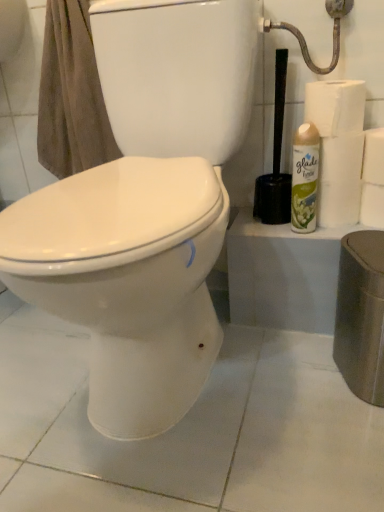
Locate an element on the screen. black plastic toilet brush at right is located at coordinates (275, 160).

The width and height of the screenshot is (384, 512). What do you see at coordinates (305, 178) in the screenshot?
I see `green matte air freshener at right` at bounding box center [305, 178].

Identify the location of green matte air freshener at right. (305, 178).

At what (x,y) coordinates should I click in order to perform the action: click on black plastic toilet brush at right. Please return your answer as a coordinate pair (x, y). The image size is (384, 512). Looking at the image, I should click on (275, 160).

From the image's perspective, is white paper at right, placed as the 4th toilet paper when sorted from top to bottom, below metallic silver showerhead at upper right?

Yes, from the image's perspective, white paper at right, placed as the 4th toilet paper when sorted from top to bottom, is below metallic silver showerhead at upper right.

Considering the relative positions of white paper at right, the first toilet paper from the bottom, and metallic silver showerhead at upper right in the image provided, is white paper at right, the first toilet paper from the bottom, to the left of metallic silver showerhead at upper right from the viewer's perspective?

In fact, white paper at right, the first toilet paper from the bottom, is to the right of metallic silver showerhead at upper right.

Is there a large distance between white paper at right, placed as the 4th toilet paper when sorted from top to bottom, and metallic silver showerhead at upper right?

No, white paper at right, placed as the 4th toilet paper when sorted from top to bottom, is not far from metallic silver showerhead at upper right.

Between white paper at right, placed as the 4th toilet paper when sorted from top to bottom, and metallic silver showerhead at upper right, which one has smaller size?

white paper at right, placed as the 4th toilet paper when sorted from top to bottom, is smaller.

Considering the positions of objects white paper at right, placed as the 4th toilet paper when sorted from top to bottom, and black plastic toilet brush at right in the image provided, who is in front, white paper at right, placed as the 4th toilet paper when sorted from top to bottom, or black plastic toilet brush at right?

black plastic toilet brush at right is in front.

Which is correct: white paper at right, placed as the 4th toilet paper when sorted from top to bottom, is inside black plastic toilet brush at right, or outside of it?

The correct answer is: outside.

Is white paper at right, the first toilet paper from the bottom, at the right side of black plastic toilet brush at right?

Yes, white paper at right, the first toilet paper from the bottom, is to the right of black plastic toilet brush at right.

How different are the orientations of white paper at right, the first toilet paper from the bottom, and black plastic toilet brush at right in degrees?

The angle between the facing direction of white paper at right, the first toilet paper from the bottom, and the facing direction of black plastic toilet brush at right is 0.0173 degrees.

Is point (51, 16) positioned in front of point (359, 124)?

No, (51, 16) is further to viewer.

In the scene shown: Is brown cotton towel at upper left next to white paper towel at upper right, which ranks as the 1th toilet paper in top-to-bottom order, and touching it?

They are not placed beside each other.

Image resolution: width=384 pixels, height=512 pixels. I want to click on bath towel positioned vertically above the white paper towel at upper right, which ranks as the 1th toilet paper in top-to-bottom order (from a real-world perspective), so click(x=71, y=95).

Does black plastic toilet brush at right appear on the left side of brown cotton towel at upper left?

In fact, black plastic toilet brush at right is to the right of brown cotton towel at upper left.

Can you tell me how much black plastic toilet brush at right and brown cotton towel at upper left differ in facing direction?

The angular difference between black plastic toilet brush at right and brown cotton towel at upper left is 0.0821 degrees.

Are black plastic toilet brush at right and brown cotton towel at upper left located far from each other?

That's not correct — black plastic toilet brush at right is a little close to brown cotton towel at upper left.

Is green matte air freshener at right in contact with white paper towel at right, the 3th toilet paper in the top-to-bottom sequence?

Yes, green matte air freshener at right is next to white paper towel at right, the 3th toilet paper in the top-to-bottom sequence.

Looking at this image, is green matte air freshener at right looking in the opposite direction of white paper towel at right, marked as the 2th toilet paper in a bottom-to-top arrangement?

green matte air freshener at right is not turned away from white paper towel at right, marked as the 2th toilet paper in a bottom-to-top arrangement.

Between green matte air freshener at right and white paper towel at right, marked as the 2th toilet paper in a bottom-to-top arrangement, which one has smaller width?

Thinner between the two is green matte air freshener at right.

Which is closer to the camera, (316, 152) or (333, 215)?

Point (316, 152).

From the image's perspective, is white paper towel at right, the 3th toilet paper in the top-to-bottom sequence, over metallic silver showerhead at upper right?

No, from the image's perspective, white paper towel at right, the 3th toilet paper in the top-to-bottom sequence, is not over metallic silver showerhead at upper right.

Does white paper towel at right, marked as the 2th toilet paper in a bottom-to-top arrangement, appear on the right side of metallic silver showerhead at upper right?

Correct, you'll find white paper towel at right, marked as the 2th toilet paper in a bottom-to-top arrangement, to the right of metallic silver showerhead at upper right.

Is point (333, 199) positioned behind point (296, 36)?

Yes, point (333, 199) is behind point (296, 36).

Is point (105, 119) closer to camera compared to point (368, 204)?

That is False.

Is brown cotton towel at upper left oriented towards white paper at right, the first toilet paper from the bottom?

No.

Looking at this image, considering the relative sizes of brown cotton towel at upper left and white paper at right, the first toilet paper from the bottom, in the image provided, is brown cotton towel at upper left shorter than white paper at right, the first toilet paper from the bottom,?

No.

Which object is closer to the camera, brown cotton towel at upper left or white paper at right, placed as the 4th toilet paper when sorted from top to bottom?

brown cotton towel at upper left is more forward.

Where is `the 3rd toilet paper below the metallic silver showerhead at upper right (from a real-world perspective)`? This screenshot has height=512, width=384. the 3rd toilet paper below the metallic silver showerhead at upper right (from a real-world perspective) is located at coordinates (372, 205).

Image resolution: width=384 pixels, height=512 pixels. I want to click on brush that appears above the white paper at right, placed as the 4th toilet paper when sorted from top to bottom (from the image's perspective), so click(x=275, y=160).

Estimate the real-world distances between objects in this image. Which object is further from white paper towel at upper right, arranged as the 4th toilet paper when ordered from the bottom, white paper at right, placed as the 4th toilet paper when sorted from top to bottom, or brown cotton towel at upper left?

brown cotton towel at upper left.

Considering their positions, is metallic silver showerhead at upper right positioned closer to white paper at right, the first toilet paper from the bottom, than white paper at right, the second toilet paper from the top?

white paper at right, the second toilet paper from the top, lies closer to white paper at right, the first toilet paper from the bottom, than the other object.

Based on their spatial positions, is white paper towel at upper right, which ranks as the 1th toilet paper in top-to-bottom order, or brown cotton towel at upper left further from black plastic toilet brush at right?

Based on the image, brown cotton towel at upper left appears to be further to black plastic toilet brush at right.

Considering their positions, is green matte air freshener at right positioned further to white paper at right, placed as the 4th toilet paper when sorted from top to bottom, than black plastic toilet brush at right?

Among the two, black plastic toilet brush at right is located further to white paper at right, placed as the 4th toilet paper when sorted from top to bottom.

Which object lies further to the anchor point green matte air freshener at right, white paper at right, marked as the third toilet paper in a bottom-to-top arrangement, or white paper at right, placed as the 4th toilet paper when sorted from top to bottom?

white paper at right, placed as the 4th toilet paper when sorted from top to bottom, lies further to green matte air freshener at right than the other object.

From the image, which object appears to be nearer to brown cotton towel at upper left, white paper at right, placed as the 4th toilet paper when sorted from top to bottom, or white paper towel at right, the 3th toilet paper in the top-to-bottom sequence?

white paper towel at right, the 3th toilet paper in the top-to-bottom sequence, is closer to brown cotton towel at upper left.

From the picture: Looking at the image, which one is located closer to brown cotton towel at upper left, metallic silver showerhead at upper right or white paper towel at upper right, arranged as the 4th toilet paper when ordered from the bottom?

Based on the image, metallic silver showerhead at upper right appears to be nearer to brown cotton towel at upper left.

Which object lies nearer to the anchor point green matte air freshener at right, white paper towel at right, the 3th toilet paper in the top-to-bottom sequence, or white paper at right, placed as the 4th toilet paper when sorted from top to bottom?

white paper towel at right, the 3th toilet paper in the top-to-bottom sequence.

You are a GUI agent. You are given a task and a screenshot of the screen. Output one action in this format:
    pyautogui.click(x=<x>, y=<y>)
    Task: Click on the cleaning product between metallic silver showerhead at upper right and white paper towel at right, the 3th toilet paper in the top-to-bottom sequence, from top to bottom
    This screenshot has width=384, height=512.
    Given the screenshot: What is the action you would take?
    pyautogui.click(x=305, y=178)

Locate an element on the screen. This screenshot has width=384, height=512. cleaning product located between brown cotton towel at upper left and metallic silver showerhead at upper right in the left-right direction is located at coordinates (305, 178).

Where is `brush between white paper towel at upper right, which ranks as the 1th toilet paper in top-to-bottom order, and green matte air freshener at right from top to bottom`? The width and height of the screenshot is (384, 512). brush between white paper towel at upper right, which ranks as the 1th toilet paper in top-to-bottom order, and green matte air freshener at right from top to bottom is located at coordinates [x=275, y=160].

Find the location of a particular element. The image size is (384, 512). cleaning product between brown cotton towel at upper left and white paper towel at upper right, arranged as the 4th toilet paper when ordered from the bottom, in the horizontal direction is located at coordinates (305, 178).